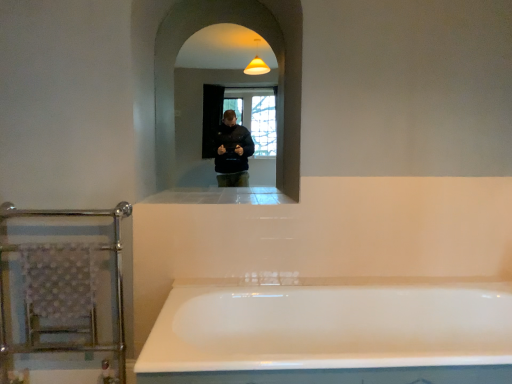
The image size is (512, 384). Describe the element at coordinates (272, 49) in the screenshot. I see `clear glass mirror at center` at that location.

Describe the element at coordinates (330, 327) in the screenshot. The image size is (512, 384). I see `white glossy bathtub at center` at that location.

What are the coordinates of `white glossy ledge at center` in the screenshot? It's located at (221, 196).

Find the location of `clear glass mirror at center`. clear glass mirror at center is located at coordinates (272, 49).

Is white glossy bathtub at center outside of white glossy ledge at center?

white glossy bathtub at center is positioned outside white glossy ledge at center.

From the image's perspective, is white glossy bathtub at center positioned above or below white glossy ledge at center?

From the image's perspective, white glossy bathtub at center appears below white glossy ledge at center.

From a real-world perspective, is white glossy bathtub at center over white glossy ledge at center?

No.

Considering the relative sizes of white glossy bathtub at center and white glossy ledge at center in the image provided, is white glossy bathtub at center thinner than white glossy ledge at center?

No.

From the image's perspective, does white glossy ledge at center appear higher than clear glass mirror at center?

No, from the image's perspective, white glossy ledge at center is not above clear glass mirror at center.

Consider the image. Between white glossy ledge at center and clear glass mirror at center, which one has less height?

white glossy ledge at center is shorter.

Is white glossy ledge at center oriented away from clear glass mirror at center?

Correct, white glossy ledge at center is looking away from clear glass mirror at center.

Identify the location of mirror above the white glossy ledge at center (from a real-world perspective). The height and width of the screenshot is (384, 512). (272, 49).

From the image's perspective, is white glossy bathtub at center on top of chrome metallic towel rack at left?

No, from the image's perspective, white glossy bathtub at center is not over chrome metallic towel rack at left.

Is white glossy bathtub at center next to chrome metallic towel rack at left and touching it?

No, white glossy bathtub at center is not making contact with chrome metallic towel rack at left.

Which is behind, point (449, 287) or point (36, 256)?

The point (449, 287) is farther from the camera.

Does white glossy bathtub at center have a greater height compared to chrome metallic towel rack at left?

In fact, white glossy bathtub at center may be shorter than chrome metallic towel rack at left.

Is white glossy ledge at center positioned behind white glossy bathtub at center?

Yes.

Does point (241, 190) appear closer or farther from the camera than point (425, 352)?

Point (241, 190) is farther from the camera than point (425, 352).

From a real-world perspective, is white glossy ledge at center positioned under white glossy bathtub at center based on gravity?

No.

Looking at this image, looking at the image, does white glossy ledge at center seem bigger or smaller compared to white glossy bathtub at center?

In the image, white glossy ledge at center appears to be smaller than white glossy bathtub at center.

Is white glossy bathtub at center positioned with its back to clear glass mirror at center?

white glossy bathtub at center does not have its back to clear glass mirror at center.

Does point (470, 331) lie in front of point (291, 41)?

Yes, point (470, 331) is in front of point (291, 41).

Considering the sizes of objects white glossy bathtub at center and clear glass mirror at center in the image provided, who is taller, white glossy bathtub at center or clear glass mirror at center?

clear glass mirror at center is taller.

Is clear glass mirror at center not within white glossy ledge at center?

Yes, clear glass mirror at center is not within white glossy ledge at center.

How different are the orientations of clear glass mirror at center and white glossy ledge at center in degrees?

The angle between the facing direction of clear glass mirror at center and the facing direction of white glossy ledge at center is 0.00069 degrees.

From the image's perspective, which is below, clear glass mirror at center or white glossy ledge at center?

white glossy ledge at center, from the image's perspective.

Is point (186, 3) positioned behind point (202, 203)?

Yes.

Which object is closer to the camera, clear glass mirror at center or chrome metallic towel rack at left?

chrome metallic towel rack at left is more forward.

Considering the points (296, 7) and (106, 265), which point is behind, point (296, 7) or point (106, 265)?

The point (296, 7) is more distant.

From a real-world perspective, which object rests below the other?

In real-world perspective, chrome metallic towel rack at left is lower.

Is clear glass mirror at center oriented towards chrome metallic towel rack at left?

No.

In the image, there is a white glossy ledge at center. Identify the location of bathtub below it (from the image's perspective). (330, 327).

Find the location of `ledge that is under the clear glass mirror at center (from a real-world perspective)`. ledge that is under the clear glass mirror at center (from a real-world perspective) is located at coordinates (221, 196).

Considering their positions, is white glossy bathtub at center positioned further to chrome metallic towel rack at left than white glossy ledge at center?

white glossy bathtub at center is further to chrome metallic towel rack at left.

Considering their positions, is clear glass mirror at center positioned closer to white glossy ledge at center than chrome metallic towel rack at left?

clear glass mirror at center is positioned closer to the anchor white glossy ledge at center.

Looking at this image, from the image, which object appears to be farther from white glossy bathtub at center, white glossy ledge at center or chrome metallic towel rack at left?

Among the two, chrome metallic towel rack at left is located further to white glossy bathtub at center.

Looking at the image, which one is located closer to chrome metallic towel rack at left, white glossy ledge at center or white glossy bathtub at center?

The object closer to chrome metallic towel rack at left is white glossy ledge at center.

When comparing their distances from white glossy bathtub at center, does chrome metallic towel rack at left or clear glass mirror at center seem further?

clear glass mirror at center lies further to white glossy bathtub at center than the other object.

Estimate the real-world distances between objects in this image. Which object is closer to clear glass mirror at center, white glossy ledge at center or chrome metallic towel rack at left?

white glossy ledge at center is positioned closer to the anchor clear glass mirror at center.

Considering their positions, is clear glass mirror at center positioned further to white glossy ledge at center than white glossy bathtub at center?

Among the two, white glossy bathtub at center is located further to white glossy ledge at center.

Estimate the real-world distances between objects in this image. Which object is closer to chrome metallic towel rack at left, clear glass mirror at center or white glossy ledge at center?

Based on the image, white glossy ledge at center appears to be nearer to chrome metallic towel rack at left.

The height and width of the screenshot is (384, 512). What are the coordinates of `ledge between chrome metallic towel rack at left and white glossy bathtub at center` in the screenshot? It's located at (221, 196).

This screenshot has height=384, width=512. Identify the location of balustrade between clear glass mirror at center and white glossy bathtub at center vertically. (62, 287).

Where is `ledge between clear glass mirror at center and white glossy bathtub at center vertically`? This screenshot has width=512, height=384. ledge between clear glass mirror at center and white glossy bathtub at center vertically is located at coordinates (221, 196).

The height and width of the screenshot is (384, 512). Find the location of `ledge between clear glass mirror at center and chrome metallic towel rack at left from top to bottom`. ledge between clear glass mirror at center and chrome metallic towel rack at left from top to bottom is located at coordinates (221, 196).